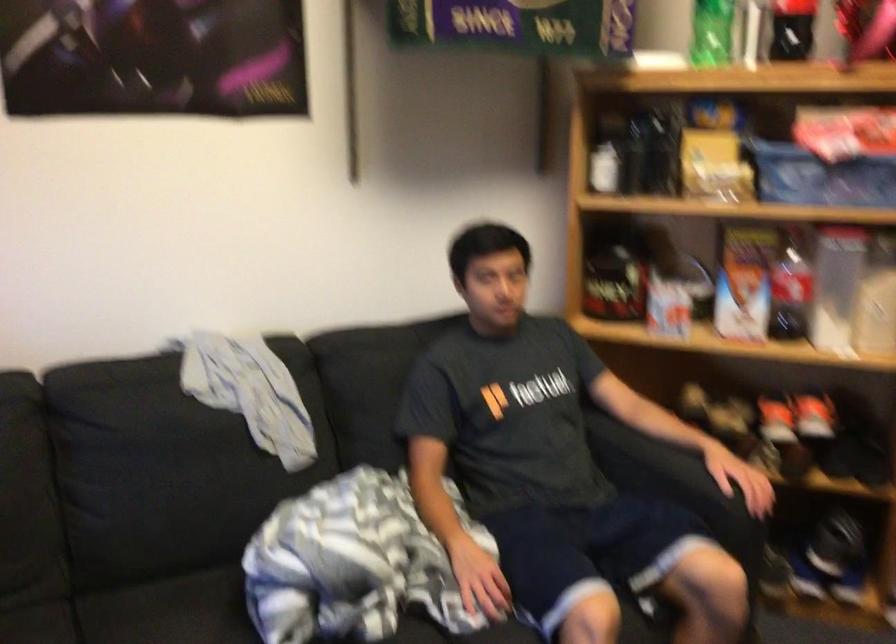
The image size is (896, 644). In order to click on sofa sitting surface in this screenshot , I will do `click(169, 611)`.